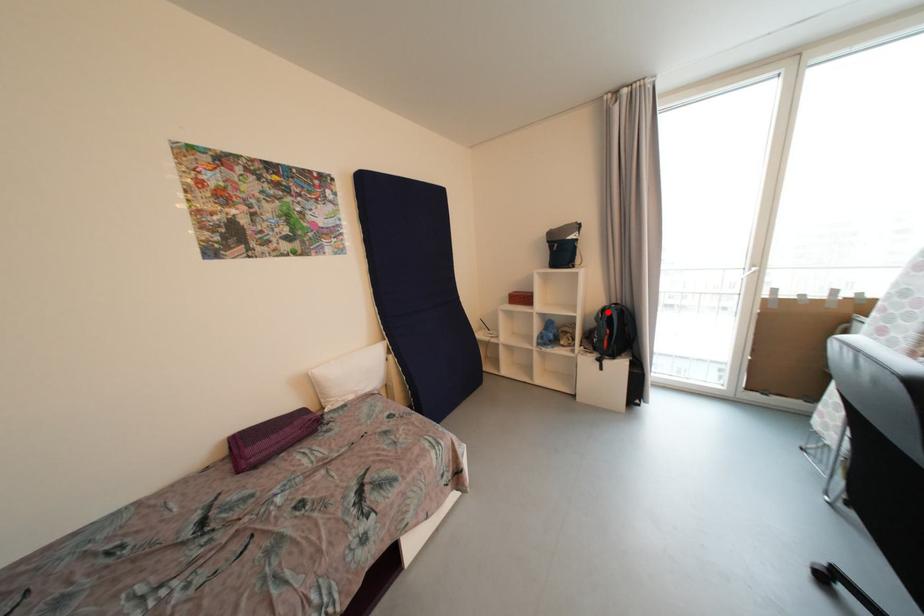
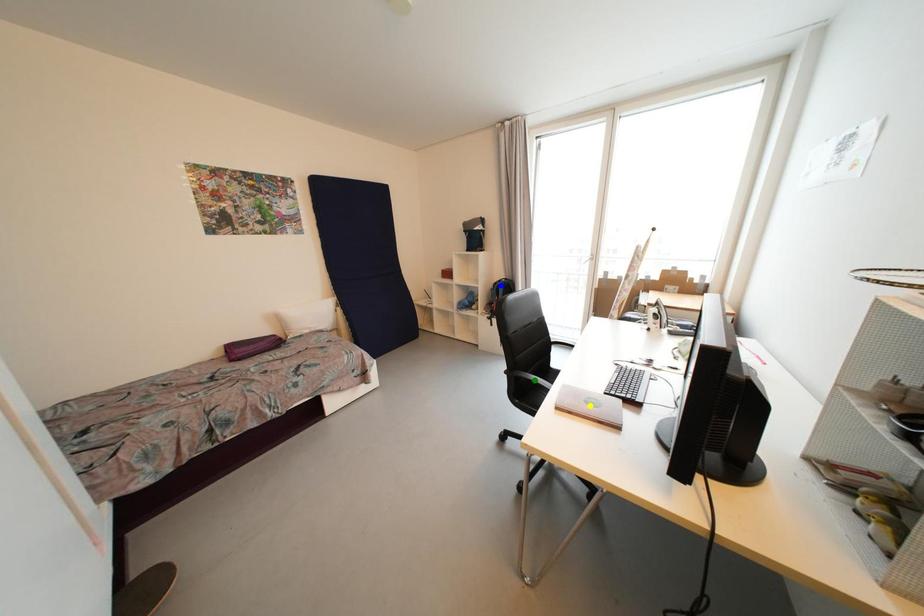
Question: I am providing you with two images of the same scene from different viewpoints. A red point is marked on the first image. You are given multiple points on the second image. Which spot in image 2 lines up with the point in image 1?

Choices:
 (A) green point
 (B) yellow point
 (C) blue point

Answer: (C)